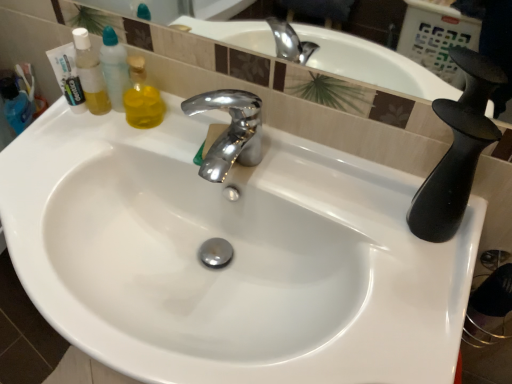
Question: Is white glossy sink at center thinner than polished chrome faucet at center?

Choices:
 (A) yes
 (B) no

Answer: (B)

Question: Is white glossy sink at center with polished chrome faucet at center?

Choices:
 (A) yes
 (B) no

Answer: (B)

Question: Would you consider white glossy sink at center to be distant from polished chrome faucet at center?

Choices:
 (A) yes
 (B) no

Answer: (B)

Question: From a real-world perspective, is white glossy sink at center on top of polished chrome faucet at center?

Choices:
 (A) no
 (B) yes

Answer: (A)

Question: Does white glossy sink at center come behind polished chrome faucet at center?

Choices:
 (A) yes
 (B) no

Answer: (B)

Question: Does white glossy sink at center have a smaller size compared to polished chrome faucet at center?

Choices:
 (A) no
 (B) yes

Answer: (A)

Question: Is polished chrome faucet at center located outside translucent plastic mouthwash at left?

Choices:
 (A) yes
 (B) no

Answer: (A)

Question: Is the depth of polished chrome faucet at center greater than that of translucent plastic mouthwash at left?

Choices:
 (A) no
 (B) yes

Answer: (B)

Question: From a real-world perspective, is polished chrome faucet at center located higher than translucent plastic mouthwash at left?

Choices:
 (A) yes
 (B) no

Answer: (B)

Question: Is polished chrome faucet at center positioned before translucent plastic mouthwash at left?

Choices:
 (A) yes
 (B) no

Answer: (B)

Question: From the image's perspective, is polished chrome faucet at center below translucent plastic mouthwash at left?

Choices:
 (A) yes
 (B) no

Answer: (A)

Question: Considering the relative sizes of polished chrome faucet at center and translucent plastic mouthwash at left in the image provided, is polished chrome faucet at center smaller than translucent plastic mouthwash at left?

Choices:
 (A) no
 (B) yes

Answer: (B)

Question: Can you confirm if polished chrome faucet at center is thinner than white glossy sink at center?

Choices:
 (A) yes
 (B) no

Answer: (A)